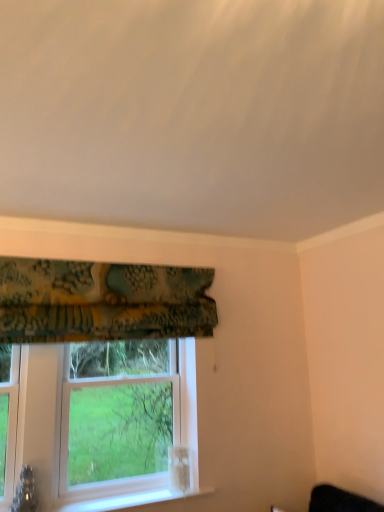
Question: In terms of width, does white plastic window at center look wider or thinner when compared to textured green fabric at upper left?

Choices:
 (A) thin
 (B) wide

Answer: (B)

Question: Is white plastic window at center spatially inside textured green fabric at upper left, or outside of it?

Choices:
 (A) outside
 (B) inside

Answer: (A)

Question: In the image, is white plastic window at center positioned in front of or behind textured green fabric at upper left?

Choices:
 (A) front
 (B) behind

Answer: (B)

Question: Is textured green fabric at upper left taller or shorter than white plastic window at center?

Choices:
 (A) tall
 (B) short

Answer: (B)

Question: Choose the correct answer: Is textured green fabric at upper left inside white plastic window at center or outside it?

Choices:
 (A) outside
 (B) inside

Answer: (A)

Question: From a real-world perspective, is textured green fabric at upper left physically located above or below white plastic window at center?

Choices:
 (A) above
 (B) below

Answer: (A)

Question: Does point (187, 306) appear closer or farther from the camera than point (87, 399)?

Choices:
 (A) closer
 (B) farther

Answer: (A)